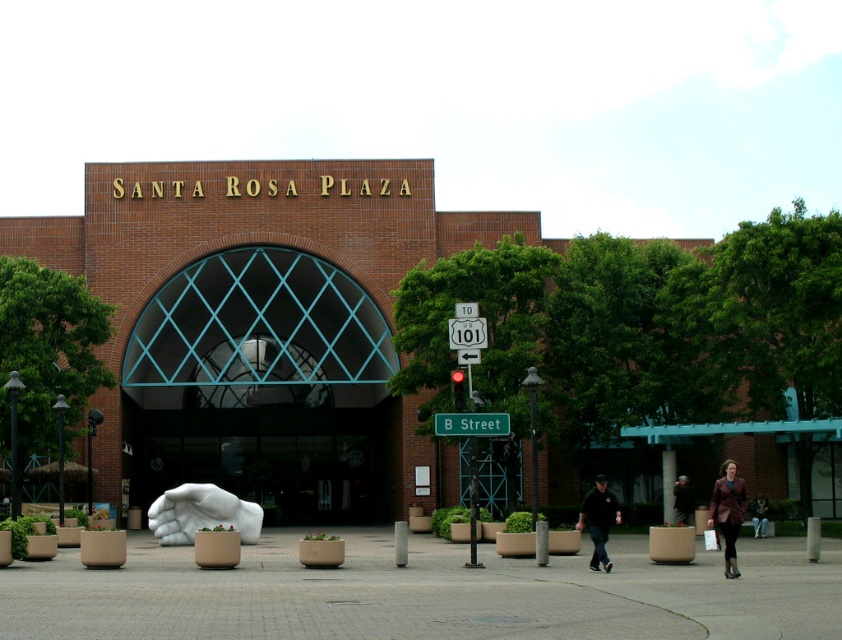
Question: Among these objects, which one is farthest from the camera?

Choices:
 (A) smooth concrete pavement at center
 (B) brown leather jacket at lower right

Answer: (B)

Question: Which object appears closest to the camera in this image?

Choices:
 (A) white marble hand at center
 (B) brown leather jacket at lower right

Answer: (B)

Question: Is smooth concrete pavement at center below white marble hand at center?

Choices:
 (A) no
 (B) yes

Answer: (A)

Question: Observing the image, what is the correct spatial positioning of dark blue shirt at center in reference to dark brown leather jacket at lower right?

Choices:
 (A) left
 (B) right

Answer: (A)

Question: Estimate the real-world distances between objects in this image. Which object is farther from the brown leather jacket at lower right?

Choices:
 (A) dark brown leather jacket at center
 (B) smooth concrete pavement at center
 (C) white marble sculpture at center
 (D) dark brown leather jacket at lower right

Answer: (C)

Question: Does smooth concrete pavement at center have a larger size compared to brown leather jacket at lower right?

Choices:
 (A) yes
 (B) no

Answer: (A)